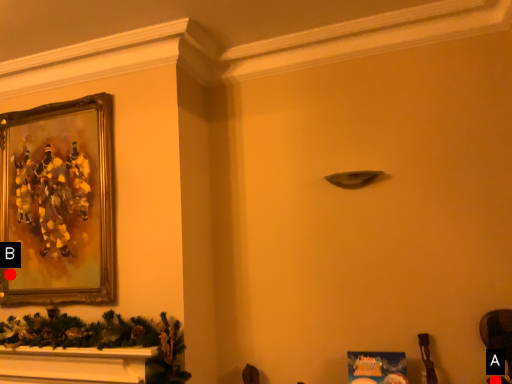
Question: Two points are circled on the image, labeled by A and B beside each circle. Which of the following is the farthest from the observer?

Choices:
 (A) A is further
 (B) B is further

Answer: (B)